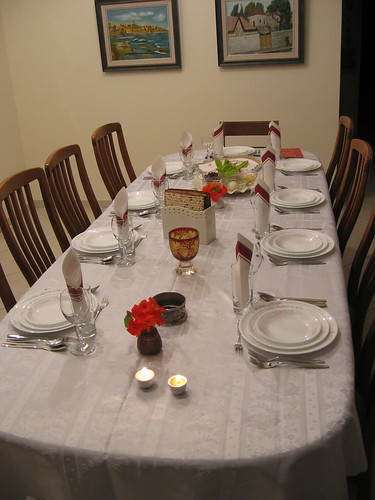
What are the coordinates of `chairs` in the screenshot? It's located at 364,251, 359,193, 347,123, 247,127, 104,132, 56,155, 22,181, 5,296, 371,358.